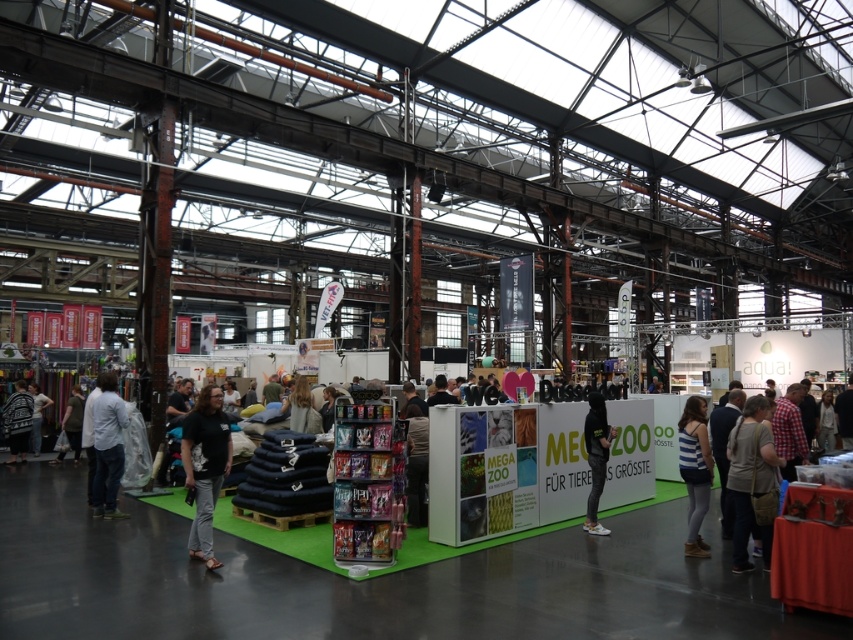
Question: Can you confirm if denim jacket at left is thinner than dark gray jeans at center?

Choices:
 (A) yes
 (B) no

Answer: (A)

Question: Which object is farther from the camera taking this photo?

Choices:
 (A) dark gray sweater at left
 (B) denim jacket at left
 (C) blue striped tank top at center
 (D) black cotton shirt at center

Answer: (A)

Question: Among these objects, which one is farthest from the camera?

Choices:
 (A) light gray cotton shirt at center
 (B) dark gray sweater at left
 (C) light brown fabric bag at lower right
 (D) black cotton shirt at center

Answer: (B)

Question: Is denim jacket at left bigger than dark gray sweater at left?

Choices:
 (A) no
 (B) yes

Answer: (A)

Question: Does black cotton shirt at center appear on the left side of dark gray sweater at left?

Choices:
 (A) yes
 (B) no

Answer: (B)

Question: Which object appears farthest from the camera in this image?

Choices:
 (A) dark gray sweater at left
 (B) black matte jacket at center
 (C) denim jacket at left

Answer: (A)